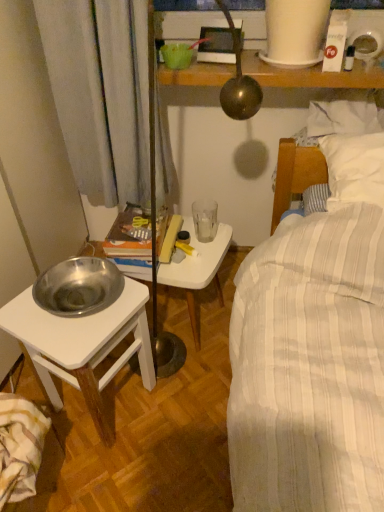
Identify the location of free spot below white plastic table at center (from a real-world perspective). (204, 325).